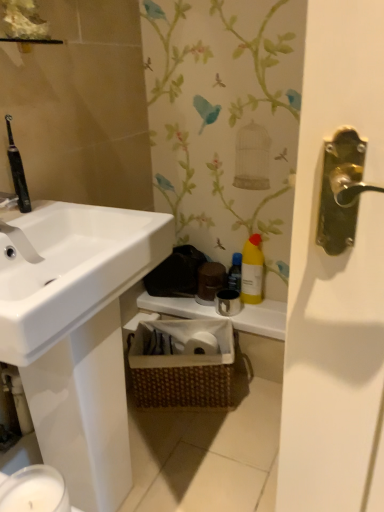
Question: Is woven brown basket at center completely or partially outside of yellow matte bottle at center?

Choices:
 (A) yes
 (B) no

Answer: (A)

Question: From the image's perspective, is woven brown basket at center on yellow matte bottle at center?

Choices:
 (A) yes
 (B) no

Answer: (B)

Question: Is woven brown basket at center wider than yellow matte bottle at center?

Choices:
 (A) yes
 (B) no

Answer: (A)

Question: Can you confirm if woven brown basket at center is positioned to the right of yellow matte bottle at center?

Choices:
 (A) yes
 (B) no

Answer: (B)

Question: From a real-world perspective, is woven brown basket at center beneath yellow matte bottle at center?

Choices:
 (A) no
 (B) yes

Answer: (B)

Question: From a real-world perspective, does woven brown basket at center stand above yellow matte bottle at center?

Choices:
 (A) no
 (B) yes

Answer: (A)

Question: From the image's perspective, is yellow plastic bottle at upper right beneath woven brown basket at center?

Choices:
 (A) no
 (B) yes

Answer: (A)

Question: Is yellow plastic bottle at upper right bigger than woven brown basket at center?

Choices:
 (A) no
 (B) yes

Answer: (A)

Question: Is yellow plastic bottle at upper right further to camera compared to woven brown basket at center?

Choices:
 (A) yes
 (B) no

Answer: (A)

Question: From a real-world perspective, is yellow plastic bottle at upper right on woven brown basket at center?

Choices:
 (A) yes
 (B) no

Answer: (A)

Question: Considering the relative sizes of yellow plastic bottle at upper right and woven brown basket at center in the image provided, is yellow plastic bottle at upper right shorter than woven brown basket at center?

Choices:
 (A) no
 (B) yes

Answer: (A)

Question: Is yellow plastic bottle at upper right facing towards woven brown basket at center?

Choices:
 (A) yes
 (B) no

Answer: (B)

Question: Considering the relative sizes of yellow matte bottle at center and white matte counter top at center in the image provided, is yellow matte bottle at center smaller than white matte counter top at center?

Choices:
 (A) yes
 (B) no

Answer: (A)